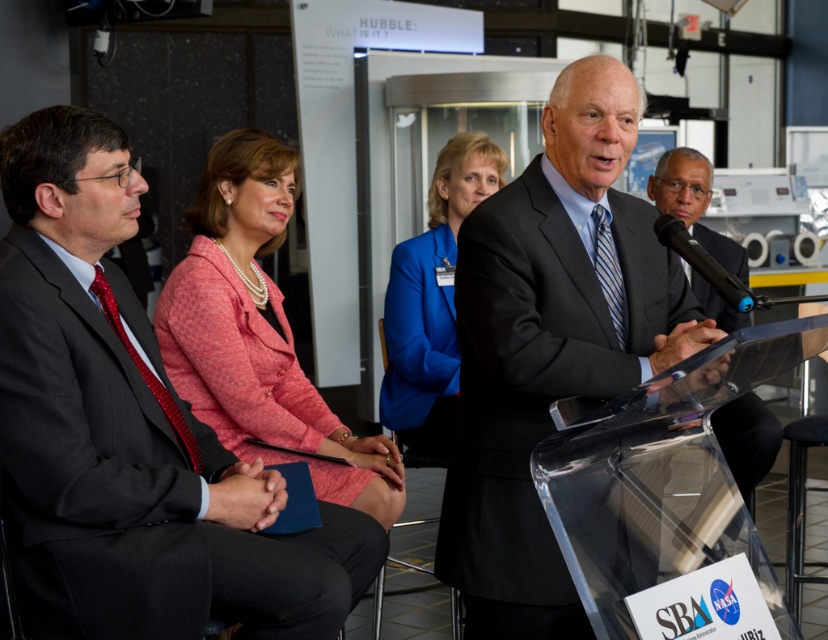
You are a photographer at the event and need to position your camera to capture the blue fabric jacket at center clearly. Based on the scene description, where should you aim your camera to ensure the jacket is in the frame?

The blue fabric jacket at center is located at the coordinates point (432, 300), so aim your camera towards that position to ensure the jacket is centered in the frame.

You are attending a NASA event and notice two items of interest. One is the dark gray pinstripe suit at left, and the other is the black plastic microphone at center. From your perspective as an attendee, which item is positioned farther to the left?

The dark gray pinstripe suit at left is farther to the left compared to the black plastic microphone at center.

You are attending a NASA event and notice two items of interest. One is the dark gray pinstripe suit at left, and the other is the black plastic microphone at center. From your perspective as an attendee, which item is positioned lower in the image?

The dark gray pinstripe suit at left is located below the black plastic microphone at center, so it is positioned lower in the image.